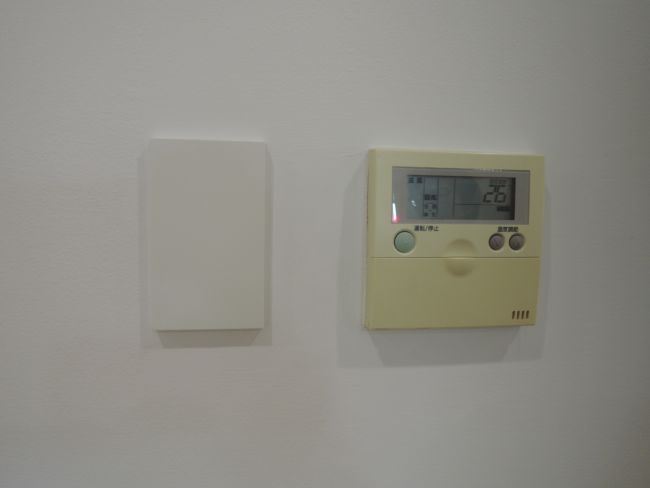
Where is `speaker`? speaker is located at coordinates (523, 315).